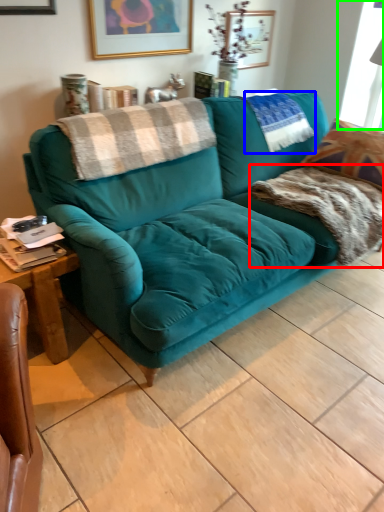
Question: Which is farther away from blanket (highlighted by a red box)? pillow (highlighted by a blue box) or window screen (highlighted by a green box)?

Choices:
 (A) pillow
 (B) window screen

Answer: (B)